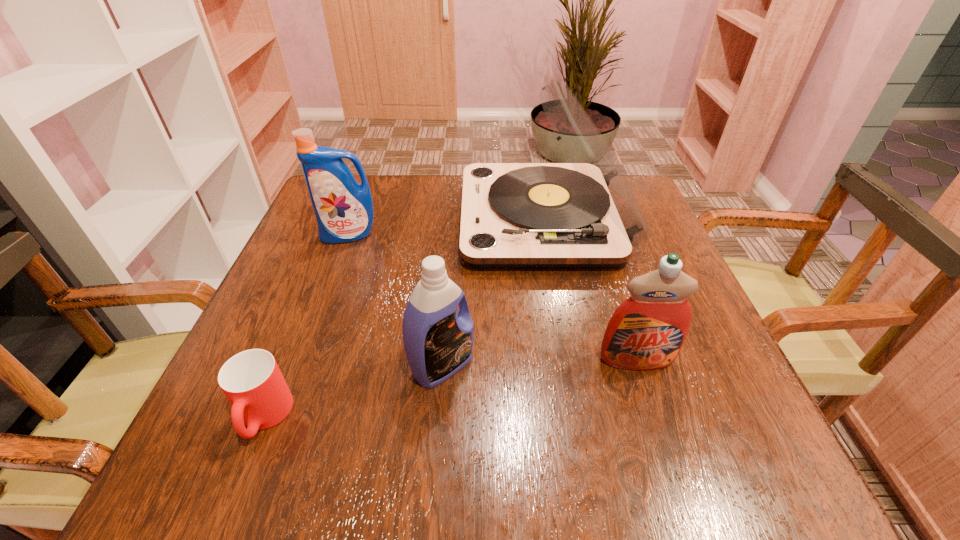
This screenshot has width=960, height=540. I want to click on record player, so click(584, 214).

Where is `the leftmost detergent`? the leftmost detergent is located at coordinates (344, 211).

Where is `the second detergent from left to right`? This screenshot has width=960, height=540. the second detergent from left to right is located at coordinates (438, 340).

Where is `the rightmost detergent`? The height and width of the screenshot is (540, 960). the rightmost detergent is located at coordinates (646, 332).

Identify the location of cup. This screenshot has width=960, height=540. (251, 380).

Locate an element on the screen. This screenshot has height=540, width=960. vacant space located with the tonearm facing the front of the tallest object is located at coordinates (339, 219).

Image resolution: width=960 pixels, height=540 pixels. Identify the location of blank space located with the tonearm facing the front of the tallest object. (310, 219).

I want to click on free space located with the tonearm facing the front of the tallest object, so click(323, 219).

Identify the location of vacant space located on the label of the farthest detergent. The image size is (960, 540). (305, 354).

Locate an element on the screen. free location located 0.250m on the left of the second detergent from right to left is located at coordinates (264, 366).